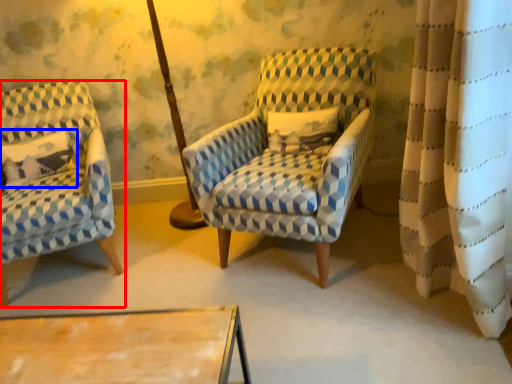
Question: Which of the following is the closest to the observer, chair (highlighted by a red box) or pillow (highlighted by a blue box)?

Choices:
 (A) chair
 (B) pillow

Answer: (A)